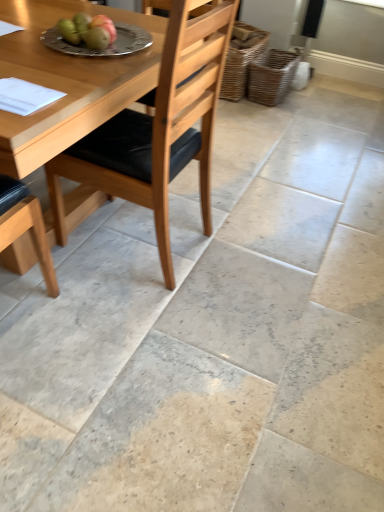
Image resolution: width=384 pixels, height=512 pixels. What are the coordinates of `vacant area that is in front of natural wood chair at center` in the screenshot? It's located at (127, 322).